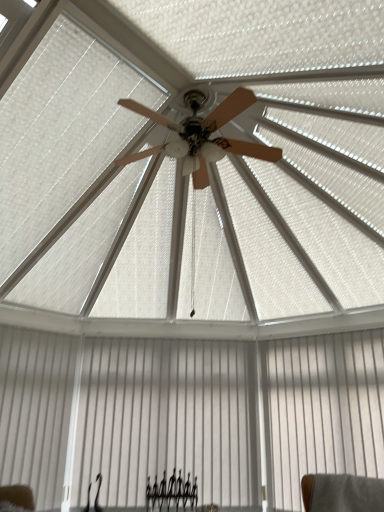
Question: From a real-world perspective, is black metal fence at lower center above or below white smooth shutter at lower left?

Choices:
 (A) below
 (B) above

Answer: (A)

Question: Based on their sizes in the image, would you say black metal fence at lower center is bigger or smaller than white smooth shutter at lower left?

Choices:
 (A) small
 (B) big

Answer: (A)

Question: Which of these objects is positioned farthest from the white matte curtain at lower center, the 2th curtain from the right?

Choices:
 (A) black metal fence at lower center
 (B) white textured curtain at lower right, which ranks as the second curtain in left-to-right order
 (C) white smooth shutter at lower left

Answer: (B)

Question: Which object is the farthest from the white textured curtain at lower right, which appears as the 1th curtain when viewed from the right?

Choices:
 (A) black metal fence at lower center
 (B) white matte curtain at lower center, which is counted as the 1th curtain, starting from the left
 (C) white smooth shutter at lower left

Answer: (C)